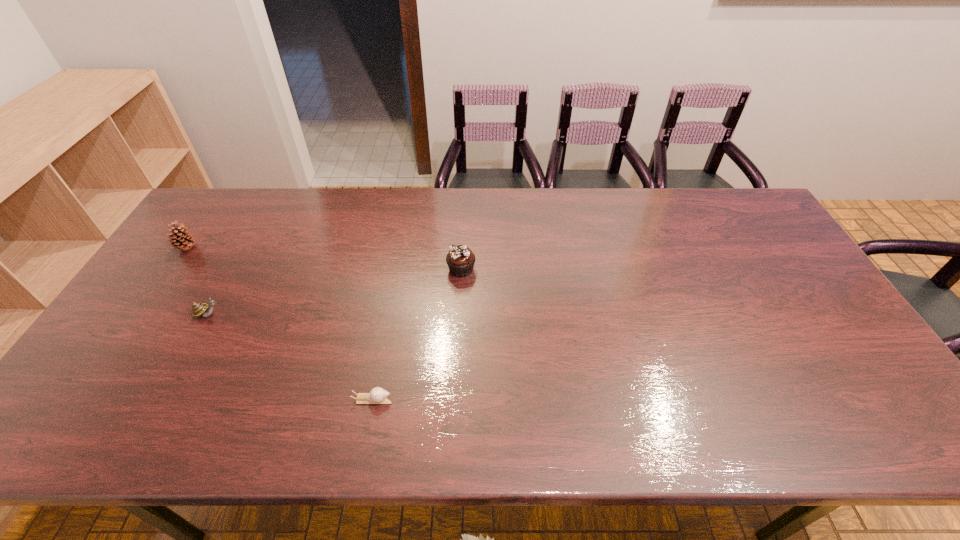
Locate an element on the screen. This screenshot has width=960, height=540. the leftmost object is located at coordinates (179, 234).

You are a GUI agent. You are given a task and a screenshot of the screen. Output one action in this format:
    pyautogui.click(x=<x>, y=<y>)
    Task: Click on the farthest object
    This screenshot has width=960, height=540.
    Given the screenshot: What is the action you would take?
    pyautogui.click(x=179, y=234)

You are a GUI agent. You are given a task and a screenshot of the screen. Output one action in this format:
    pyautogui.click(x=<x>, y=<y>)
    Task: Click on the cupcake
    This screenshot has height=540, width=960.
    Given the screenshot: What is the action you would take?
    pyautogui.click(x=460, y=259)

Image resolution: width=960 pixels, height=540 pixels. What are the coordinates of `the third nearest object` in the screenshot? It's located at (460, 259).

You are a GUI agent. You are given a task and a screenshot of the screen. Output one action in this format:
    pyautogui.click(x=<x>, y=<y>)
    Task: Click on the third object from right to left
    This screenshot has height=540, width=960.
    Given the screenshot: What is the action you would take?
    pyautogui.click(x=198, y=309)

I want to click on the taller escargot, so click(198, 309).

At what (x,y) coordinates should I click in order to perform the action: click on the nearer escargot. Please return your answer as a coordinate pair (x, y). The width and height of the screenshot is (960, 540). Looking at the image, I should click on (377, 395).

At what (x,y) coordinates should I click in order to perform the action: click on the second object from right to left. Please return your answer as a coordinate pair (x, y). This screenshot has width=960, height=540. Looking at the image, I should click on (377, 395).

Find the location of a particular element. The width and height of the screenshot is (960, 540). blank space located on the right of the pinecone is located at coordinates (320, 248).

Where is `free space located 0.220m on the back of the rightmost object`? The height and width of the screenshot is (540, 960). free space located 0.220m on the back of the rightmost object is located at coordinates click(x=464, y=215).